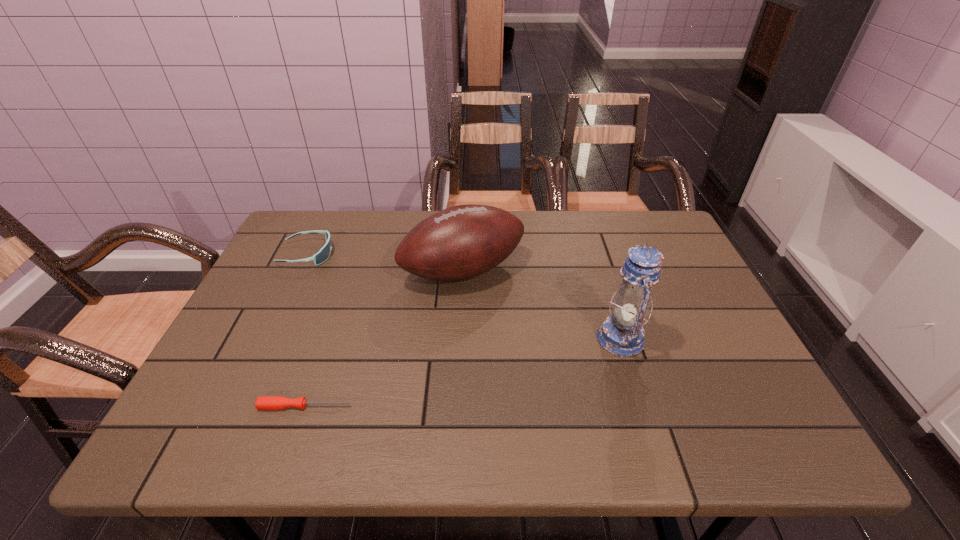
This screenshot has height=540, width=960. What are the coordinates of `the second nearest object` in the screenshot? It's located at (622, 334).

Identify the location of the rightmost object. The height and width of the screenshot is (540, 960). (622, 334).

Find the location of a particular element. the second tallest object is located at coordinates (461, 242).

You are a GUI agent. You are given a task and a screenshot of the screen. Output one action in this format:
    pyautogui.click(x=<x>, y=<y>)
    Task: Click on the second object from right to left
    Image resolution: width=960 pixels, height=540 pixels.
    Given the screenshot: What is the action you would take?
    pyautogui.click(x=461, y=242)

Identify the location of goggles. The image size is (960, 540). (324, 253).

Locate an element on the screen. The height and width of the screenshot is (540, 960). the shortest object is located at coordinates (262, 402).

What are the coordinates of `screwdriver` in the screenshot? It's located at (262, 402).

This screenshot has width=960, height=540. What are the coordinates of `vacant region located on the front-facing side of the second nearest object` in the screenshot? It's located at (482, 338).

At what (x,y) coordinates should I click in order to perform the action: click on free spot located 0.060m on the front-facing side of the second nearest object. Please return your answer as a coordinate pair (x, y). The height and width of the screenshot is (540, 960). Looking at the image, I should click on coord(571,338).

The image size is (960, 540). I want to click on free space located 0.240m on the front-facing side of the second nearest object, so click(x=495, y=338).